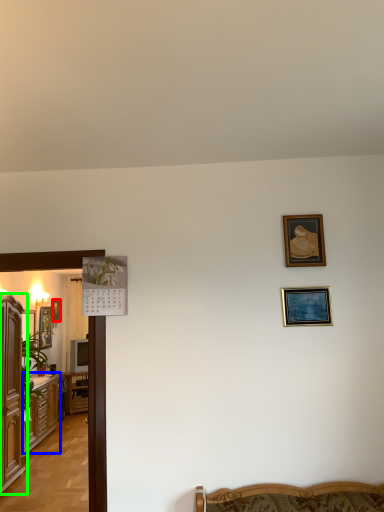
Question: Which object is positioned farthest from picture frame (highlighted by a red box)? Select from cabinetry (highlighted by a blue box) and cabinetry (highlighted by a green box).

Choices:
 (A) cabinetry
 (B) cabinetry

Answer: (B)